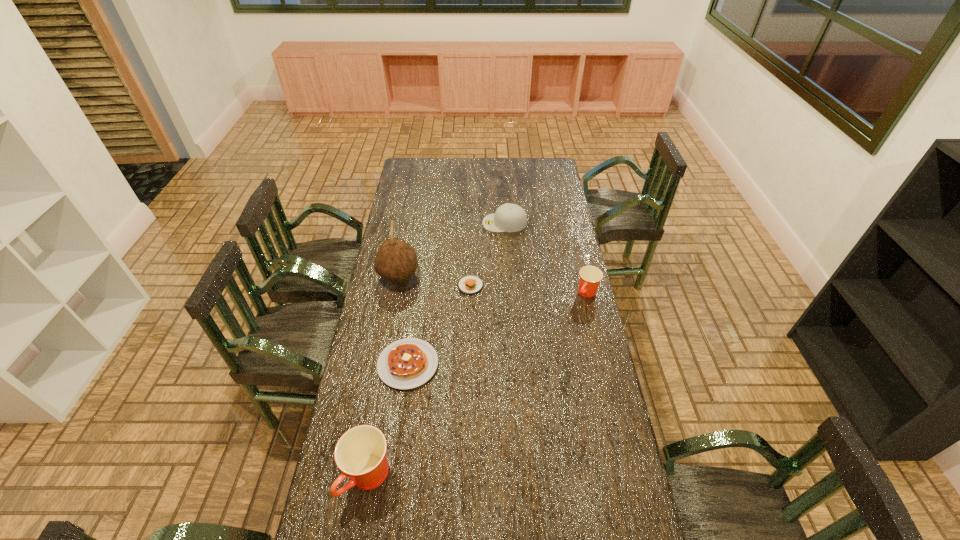
Identify the location of vacant point located 0.180m on the left of the shorter cup. (534, 293).

The height and width of the screenshot is (540, 960). In order to click on free space located 0.080m on the front-facing side of the farthest object in this screenshot , I will do `click(467, 223)`.

At what (x,y) coordinates should I click in order to perform the action: click on vacant space located 0.240m on the front-facing side of the farthest object. Please return your answer as a coordinate pair (x, y). The height and width of the screenshot is (540, 960). Looking at the image, I should click on (435, 223).

Where is `vacant space situated 0.160m on the front-facing side of the farthest object`? vacant space situated 0.160m on the front-facing side of the farthest object is located at coordinates (451, 223).

Image resolution: width=960 pixels, height=540 pixels. What are the coordinates of `vacant space situated on the right of the pancake` in the screenshot? It's located at (490, 364).

The height and width of the screenshot is (540, 960). What are the coordinates of `blank space located 0.150m on the front of the food` in the screenshot? It's located at (469, 322).

The width and height of the screenshot is (960, 540). In order to click on vacant space situated on the surface of the coconut in this screenshot , I will do `click(477, 277)`.

This screenshot has height=540, width=960. In order to click on object situated at the near edge in this screenshot , I will do `click(360, 453)`.

This screenshot has height=540, width=960. Find the location of `cup present at the left edge`. cup present at the left edge is located at coordinates (360, 453).

This screenshot has height=540, width=960. I want to click on pancake that is at the left edge, so click(407, 363).